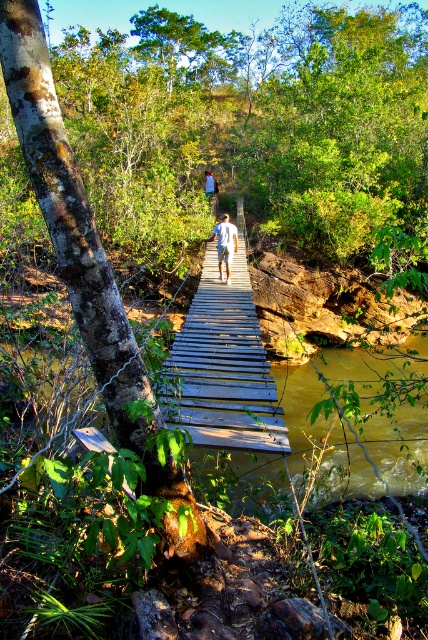
The image size is (428, 640). Describe the element at coordinates (383, 413) in the screenshot. I see `brown muddy water at center` at that location.

Based on the photo, can you confirm if brown muddy water at center is shorter than white cotton shirt at center?

No, brown muddy water at center is not shorter than white cotton shirt at center.

Does point (410, 340) lie behind point (234, 236)?

Yes.

Find the location of a particular element. brown muddy water at center is located at coordinates (383, 413).

Is wooden bridge at center above brown muddy water at center?

Yes, wooden bridge at center is above brown muddy water at center.

Measure the distance from wooden bridge at center to brown muddy water at center.

wooden bridge at center is 3.80 meters from brown muddy water at center.

Which is in front, point (177, 422) or point (360, 488)?

Point (177, 422)

This screenshot has width=428, height=640. What are the coordinates of `wooden bridge at center` in the screenshot? It's located at (225, 364).

Can you confirm if wooden bridge at center is taller than white cotton shirt at center?

Indeed, wooden bridge at center has a greater height compared to white cotton shirt at center.

Is wooden bridge at center below white cotton shirt at center?

Correct, wooden bridge at center is located below white cotton shirt at center.

I want to click on wooden bridge at center, so click(x=225, y=364).

You are a GUI agent. You are given a task and a screenshot of the screen. Output one action in this format:
    pyautogui.click(x=<x>, y=<y>)
    Task: Click on the wooden bridge at center
    
    Given the screenshot: What is the action you would take?
    pyautogui.click(x=225, y=364)